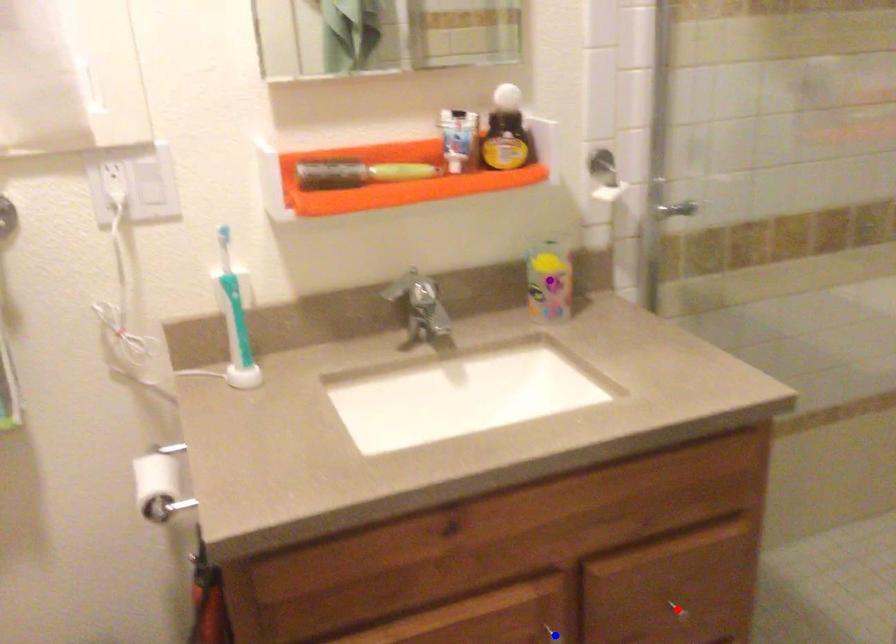
Order these from nearest to farthest:
- red point
- blue point
- purple point

blue point < red point < purple point